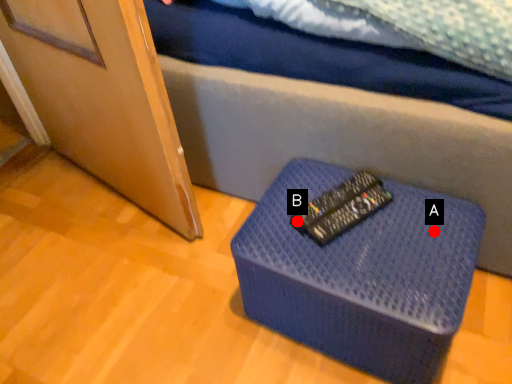
Question: Two points are circled on the image, labeled by A and B beside each circle. Which point is closer to the camera taking this photo?

Choices:
 (A) A is closer
 (B) B is closer

Answer: (A)